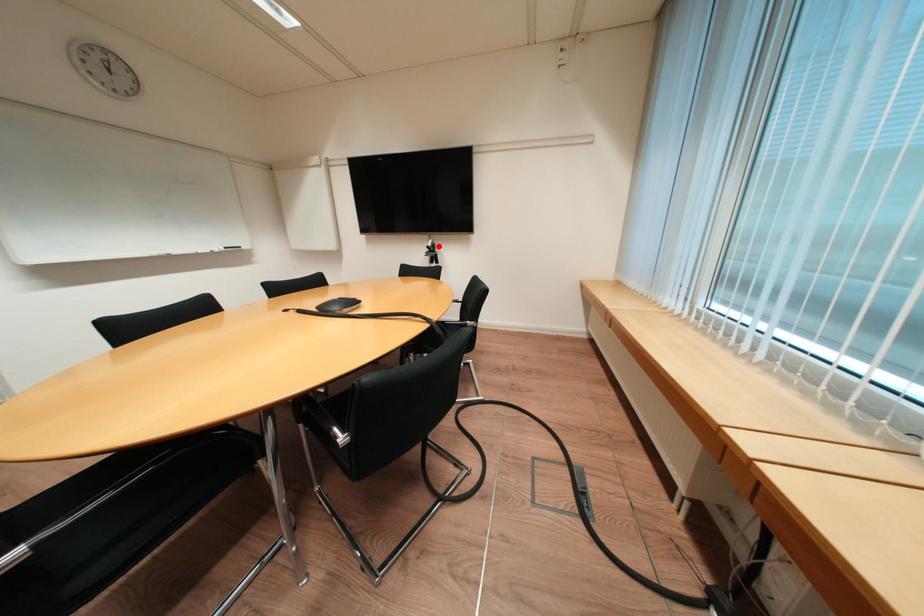
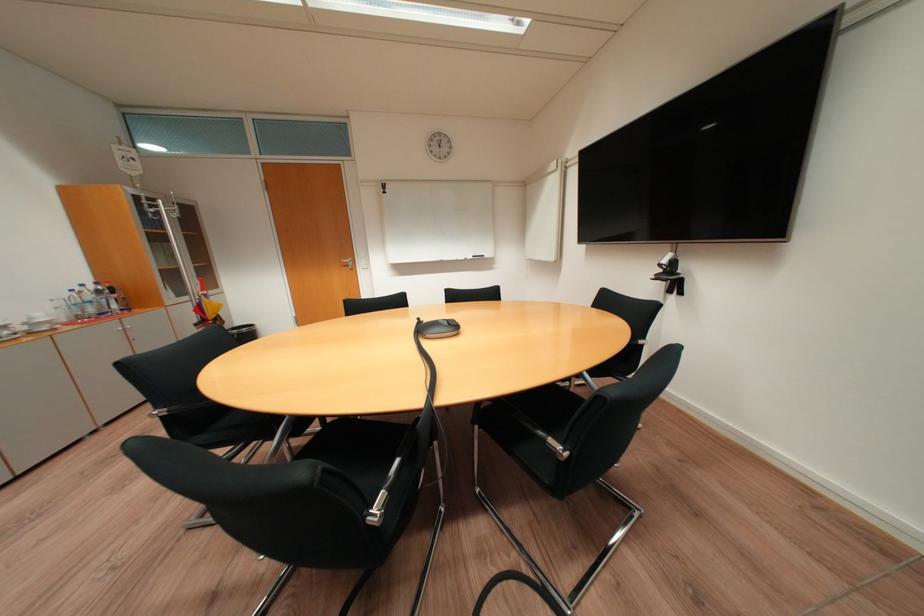
Question: I am providing you with two images of the same scene from different viewpoints. A red point is shown in image1. For the corresponding object point in image2, is it positioned nearer or farther from the camera?

Choices:
 (A) Nearer
 (B) Farther

Answer: (B)